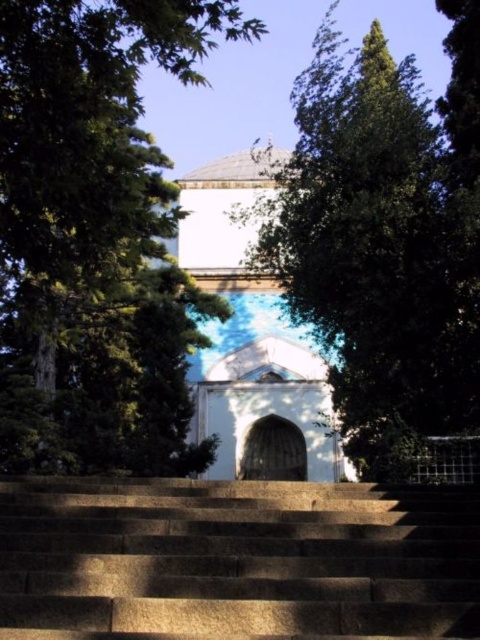
You are a tour guide explaining the layout of this historic site to visitors. You mention the brown stone stairs at center and the white marble chapel at center. Which of these two structures is wider?

The brown stone stairs at center is wider than the white marble chapel at center.

You are a landscape architect planning to install a pathway between the green leafy tree at center and the white marble chapel at center. The pathway requires a minimum of 15 meters of space. Can the existing distance accommodate this requirement?

The green leafy tree at center and the white marble chapel at center are 17.82 meters apart from each other, which exceeds the required 15 meters. Therefore, the existing distance can accommodate the pathway.

You are standing at the bottom of the stone staircase and want to know which tree is closer to you between the green leafy tree at upper center and the green leafy tree at center. Which one is closer?

The green leafy tree at center is closer to you because it is positioned lower on the staircase compared to the green leafy tree at upper center, which is higher up.